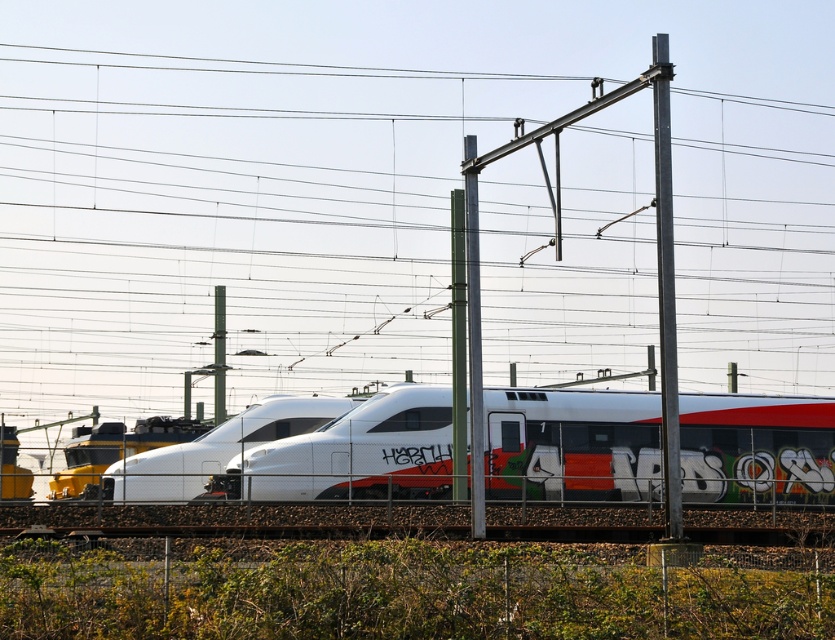
Question: Among these points, which one is farthest from the camera?

Choices:
 (A) (464, 344)
 (B) (479, 403)
 (C) (677, 476)

Answer: (A)

Question: Does metallic gray pole at center have a lesser width compared to metallic pole at center?

Choices:
 (A) yes
 (B) no

Answer: (B)

Question: Which of the following is the farthest from the observer?

Choices:
 (A) metallic gray pole at center-right
 (B) metallic pole at center
 (C) white matte train at center

Answer: (C)

Question: Can you confirm if metallic gray pole at center-right is positioned to the right of metallic gray pole at center?

Choices:
 (A) no
 (B) yes

Answer: (B)

Question: Which object is the farthest from the white matte train at center?

Choices:
 (A) metallic gray pole at center-right
 (B) metallic gray pole at center

Answer: (A)

Question: In this image, where is metallic gray pole at center-right located relative to metallic pole at center?

Choices:
 (A) left
 (B) right

Answer: (B)